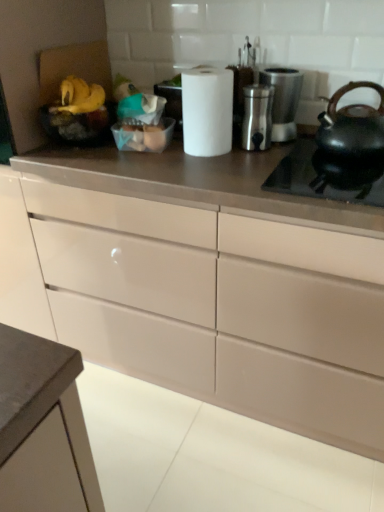
Locate an element on the screen. The width and height of the screenshot is (384, 512). vacant space to the left of white matte paper towel at center is located at coordinates (147, 160).